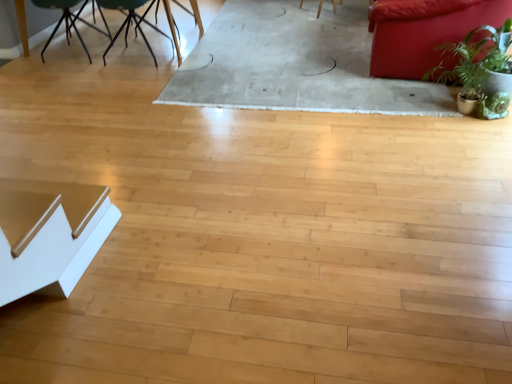
This screenshot has height=384, width=512. Find the location of `green leafy plant at right`. green leafy plant at right is located at coordinates 479,72.

What is the approximate height of green leafy plant at right?

green leafy plant at right is 18.18 inches tall.

Measure the distance between point (56,27) and camera.

A distance of 12.65 feet exists between point (56,27) and camera.

Measure the distance between green matte chair at upper left, which is the 2th chair in left-to-right order, and camera.

green matte chair at upper left, which is the 2th chair in left-to-right order, is 11.66 feet from camera.

Find the location of `metallic black table at upper left`. metallic black table at upper left is located at coordinates (22, 25).

Where is `white glossy table at lower left`? Image resolution: width=512 pixels, height=384 pixels. white glossy table at lower left is located at coordinates (50, 234).

Locate an element on the screen. The height and width of the screenshot is (384, 512). green leafy plant at right is located at coordinates pyautogui.click(x=479, y=72).

Which point is more distant from viewer, (389, 56) or (472, 82)?

Point (389, 56)

Is matte red couch at upper right positioned with its back to green leafy plant at right?

matte red couch at upper right is not turned away from green leafy plant at right.

From a real-world perspective, between matte red couch at upper right and green leafy plant at right, who is vertically lower?

In real-world perspective, green leafy plant at right is lower.

Who is bigger, matte red couch at upper right or green leafy plant at right?

Bigger between the two is matte red couch at upper right.

What's the angular difference between green matte chair at upper left, which is the 2th chair in left-to-right order, and matte red couch at upper right's facing directions?

82.7 degrees.

How far apart are green matte chair at upper left, which is the 1th chair in right-to-left order, and matte red couch at upper right?

green matte chair at upper left, which is the 1th chair in right-to-left order, is 7.09 feet away from matte red couch at upper right.

Considering the relative sizes of green matte chair at upper left, which is the 1th chair in right-to-left order, and matte red couch at upper right in the image provided, is green matte chair at upper left, which is the 1th chair in right-to-left order, thinner than matte red couch at upper right?

Indeed, green matte chair at upper left, which is the 1th chair in right-to-left order, has a lesser width compared to matte red couch at upper right.

In the scene shown: From a real-world perspective, is green matte chair at upper left, which is the 1th chair in right-to-left order, on matte red couch at upper right?

No, from a real-world perspective, green matte chair at upper left, which is the 1th chair in right-to-left order, is not above matte red couch at upper right.

Which point is more forward, [39,3] or [494,43]?

Point [494,43]

Is green leafy plant at right surrounded by green matte chair at upper left, which ranks as the first chair in left-to-right order?

That's incorrect, green leafy plant at right is not inside green matte chair at upper left, which ranks as the first chair in left-to-right order.

How much distance is there between green matte chair at upper left, the second chair viewed from the right, and green leafy plant at right?

A distance of 10.46 feet exists between green matte chair at upper left, the second chair viewed from the right, and green leafy plant at right.

Consider the image. Considering the relative positions of green matte chair at upper left, which ranks as the first chair in left-to-right order, and green leafy plant at right in the image provided, is green matte chair at upper left, which ranks as the first chair in left-to-right order, to the left or to the right of green leafy plant at right?

In the image, green matte chair at upper left, which ranks as the first chair in left-to-right order, appears on the left side of green leafy plant at right.

Looking at their sizes, would you say green matte chair at upper left, the second chair viewed from the right, is wider or thinner than green matte chair at upper left, which is the 1th chair in right-to-left order?

green matte chair at upper left, the second chair viewed from the right, is thinner than green matte chair at upper left, which is the 1th chair in right-to-left order.

Considering the sizes of objects green matte chair at upper left, which ranks as the first chair in left-to-right order, and green matte chair at upper left, which is the 1th chair in right-to-left order, in the image provided, who is shorter, green matte chair at upper left, which ranks as the first chair in left-to-right order, or green matte chair at upper left, which is the 1th chair in right-to-left order,?

Standing shorter between the two is green matte chair at upper left, which ranks as the first chair in left-to-right order.

Is green matte chair at upper left, which ranks as the first chair in left-to-right order, turned away from green matte chair at upper left, which is the 1th chair in right-to-left order?

That's not correct — green matte chair at upper left, which ranks as the first chair in left-to-right order, is not looking away from green matte chair at upper left, which is the 1th chair in right-to-left order.

Where is `round table that appears in front of the green matte chair at upper left, the second chair viewed from the right`? This screenshot has height=384, width=512. round table that appears in front of the green matte chair at upper left, the second chair viewed from the right is located at coordinates (22, 25).

Would you say metallic black table at upper left is part of green matte chair at upper left, which ranks as the first chair in left-to-right order,'s contents?

No, metallic black table at upper left is located outside of green matte chair at upper left, which ranks as the first chair in left-to-right order.

From the image's perspective, is green matte chair at upper left, which ranks as the first chair in left-to-right order, positioned above or below metallic black table at upper left?

From the image's perspective, green matte chair at upper left, which ranks as the first chair in left-to-right order, appears below metallic black table at upper left.

Which is in front, green matte chair at upper left, the second chair viewed from the right, or metallic black table at upper left?

metallic black table at upper left is closer to the camera.

Is green matte chair at upper left, which is the 2th chair in left-to-right order, positioned far away from green leafy plant at right?

Yes, green matte chair at upper left, which is the 2th chair in left-to-right order, and green leafy plant at right are quite far apart.

Considering the sizes of green matte chair at upper left, which is the 1th chair in right-to-left order, and green leafy plant at right in the image, is green matte chair at upper left, which is the 1th chair in right-to-left order, bigger or smaller than green leafy plant at right?

Considering their sizes, green matte chair at upper left, which is the 1th chair in right-to-left order, takes up more space than green leafy plant at right.

Is green leafy plant at right inside green matte chair at upper left, which is the 1th chair in right-to-left order?

Definitely not — green leafy plant at right is not inside green matte chair at upper left, which is the 1th chair in right-to-left order.

Which is more to the left, green matte chair at upper left, which is the 2th chair in left-to-right order, or green leafy plant at right?

green matte chair at upper left, which is the 2th chair in left-to-right order.

Between white glossy table at lower left and metallic black table at upper left, which one has smaller size?

white glossy table at lower left is smaller.

From a real-world perspective, is white glossy table at lower left above or below metallic black table at upper left?

In terms of real-world spatial position, white glossy table at lower left is below metallic black table at upper left.

From the image's perspective, is white glossy table at lower left positioned above or below metallic black table at upper left?

From the image's perspective, white glossy table at lower left appears below metallic black table at upper left.

Which point is more forward, (72,275) or (24,37)?

The point (72,275) is more forward.

Find the location of a particular element. houseplant located on the left of matte red couch at upper right is located at coordinates (479, 72).

You are a GUI agent. You are given a task and a screenshot of the screen. Output one action in this format:
    pyautogui.click(x=<x>, y=<y>)
    Task: Click on the chair that is the 1st object directly below the matte red couch at upper right (from a real-world perspective)
    
    Given the screenshot: What is the action you would take?
    pyautogui.click(x=131, y=21)

Based on their spatial positions, is white glossy table at lower left or green matte chair at upper left, the second chair viewed from the right, further from matte red couch at upper right?

green matte chair at upper left, the second chair viewed from the right, is positioned further to the anchor matte red couch at upper right.

Consider the image. When comparing their distances from metallic black table at upper left, does white glossy table at lower left or green leafy plant at right seem further?

The object further to metallic black table at upper left is green leafy plant at right.

Considering their positions, is metallic black table at upper left positioned closer to green matte chair at upper left, the second chair viewed from the right, than matte red couch at upper right?

Based on the image, metallic black table at upper left appears to be nearer to green matte chair at upper left, the second chair viewed from the right.

Based on their spatial positions, is green leafy plant at right or white glossy table at lower left further from matte red couch at upper right?

white glossy table at lower left is further to matte red couch at upper right.

Which object lies nearer to the anchor point green matte chair at upper left, which ranks as the first chair in left-to-right order, white glossy table at lower left or metallic black table at upper left?

metallic black table at upper left is positioned closer to the anchor green matte chair at upper left, which ranks as the first chair in left-to-right order.

When comparing their distances from matte red couch at upper right, does green matte chair at upper left, which is the 1th chair in right-to-left order, or white glossy table at lower left seem closer?

The object closer to matte red couch at upper right is green matte chair at upper left, which is the 1th chair in right-to-left order.

Based on their spatial positions, is metallic black table at upper left or green matte chair at upper left, which ranks as the first chair in left-to-right order, further from matte red couch at upper right?

The object further to matte red couch at upper right is metallic black table at upper left.

When comparing their distances from white glossy table at lower left, does metallic black table at upper left or green matte chair at upper left, which ranks as the first chair in left-to-right order, seem further?

Based on the image, metallic black table at upper left appears to be further to white glossy table at lower left.

Locate an element on the screen. This screenshot has height=384, width=512. chair between green matte chair at upper left, the second chair viewed from the right, and matte red couch at upper right from left to right is located at coordinates (131, 21).

Identify the location of houseplant situated between green matte chair at upper left, which is the 2th chair in left-to-right order, and matte red couch at upper right from left to right. The image size is (512, 384). point(479,72).

I want to click on table between green matte chair at upper left, which is the 2th chair in left-to-right order, and green leafy plant at right, in the horizontal direction, so click(50, 234).

Identify the location of round table between green matte chair at upper left, which ranks as the first chair in left-to-right order, and green leafy plant at right from left to right. Image resolution: width=512 pixels, height=384 pixels. (22, 25).